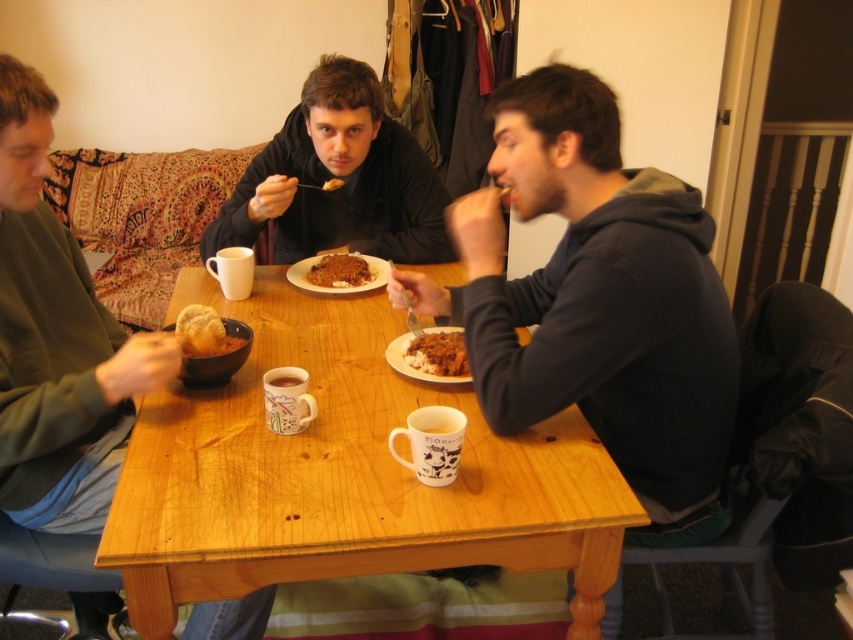
In the scene shown: Can you confirm if wooden table at center is positioned above white glossy mug at table center?

Actually, wooden table at center is below white glossy mug at table center.

In the scene shown: Who is positioned more to the right, wooden table at center or white glossy mug at table center?

wooden table at center

This screenshot has width=853, height=640. What do you see at coordinates (341, 474) in the screenshot?
I see `wooden table at center` at bounding box center [341, 474].

This screenshot has width=853, height=640. I want to click on wooden table at center, so click(341, 474).

Can you confirm if wooden table at center is positioned below matte brown bowl at center?

Yes, wooden table at center is below matte brown bowl at center.

Is wooden table at center to the left of matte brown bowl at center from the viewer's perspective?

In fact, wooden table at center is to the right of matte brown bowl at center.

Between point (231, 436) and point (231, 358), which one is positioned in front?

Point (231, 436) is more forward.

You are a GUI agent. You are given a task and a screenshot of the screen. Output one action in this format:
    pyautogui.click(x=<x>, y=<y>)
    Task: Click on the wooden table at center
    Image resolution: width=853 pixels, height=640 pixels.
    Given the screenshot: What is the action you would take?
    pyautogui.click(x=341, y=474)

Who is more forward, (364, 218) or (314, 269)?

Point (314, 269) is more forward.

Is matte black hoodie at center positioned in front of brown crumbly at center?

Yes, it is in front of brown crumbly at center.

In the scene shown: Who is more distant from viewer, (320, 236) or (308, 276)?

Point (320, 236)

Locate an element on the screen. The image size is (853, 640). matte black hoodie at center is located at coordinates (340, 177).